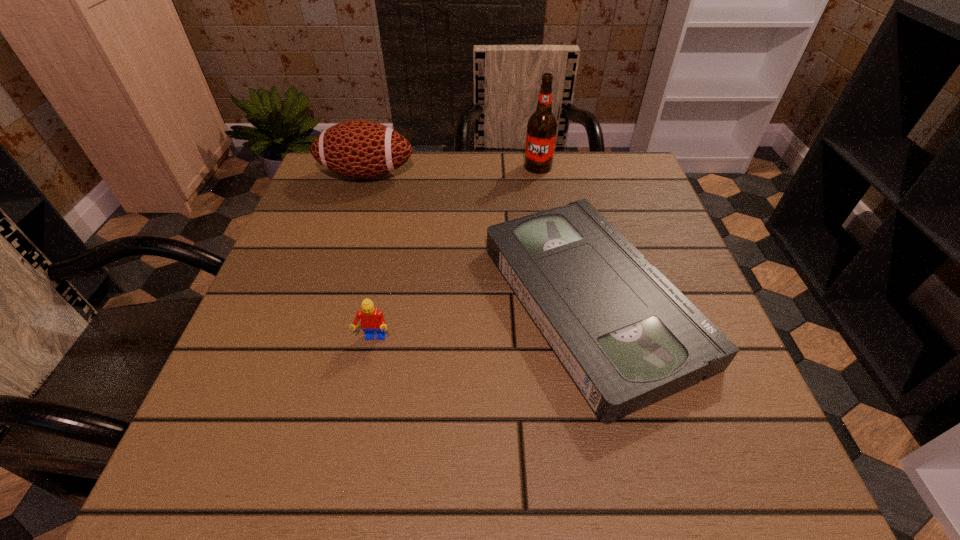
Identify the location of object that is positioned at the left edge. (360, 149).

The image size is (960, 540). What are the coordinates of `object at the right edge` in the screenshot? It's located at (627, 337).

What are the coordinates of `object at the far left corner` in the screenshot? It's located at (360, 149).

Find the location of a particular element. This screenshot has height=540, width=960. vacant position at the far edge of the desktop is located at coordinates (475, 159).

The image size is (960, 540). In the image, there is a desktop. Identify the location of vacant area at the near edge. (486, 470).

The width and height of the screenshot is (960, 540). What are the coordinates of `free space at the left edge of the desktop` in the screenshot? It's located at (334, 335).

You are a GUI agent. You are given a task and a screenshot of the screen. Output one action in this format:
    pyautogui.click(x=<x>, y=<y>)
    Task: Click on the free region at the right edge
    
    Given the screenshot: What is the action you would take?
    pyautogui.click(x=659, y=229)

Image resolution: width=960 pixels, height=540 pixels. In the image, there is a desktop. What are the coordinates of `free region at the far right corner` in the screenshot? It's located at (628, 204).

You are a GUI agent. You are given a task and a screenshot of the screen. Output one action in this format:
    pyautogui.click(x=<x>, y=<y>)
    Task: Click on the vacant area that lies between the second shortest object and the football
    Image resolution: width=960 pixels, height=540 pixels.
    Given the screenshot: What is the action you would take?
    pyautogui.click(x=370, y=256)

In order to click on vacant region between the football and the root beer in this screenshot , I will do `click(452, 171)`.